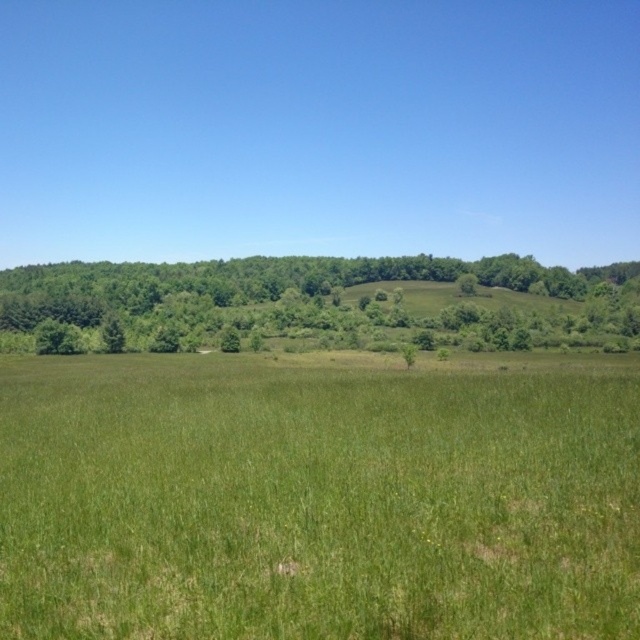
Identify the location of green grassy field at center. (316, 500).

Is point (97, 554) positioned before point (230, 308)?

Yes.

Find the location of a particular element. This screenshot has width=640, height=640. green grassy field at center is located at coordinates (316, 500).